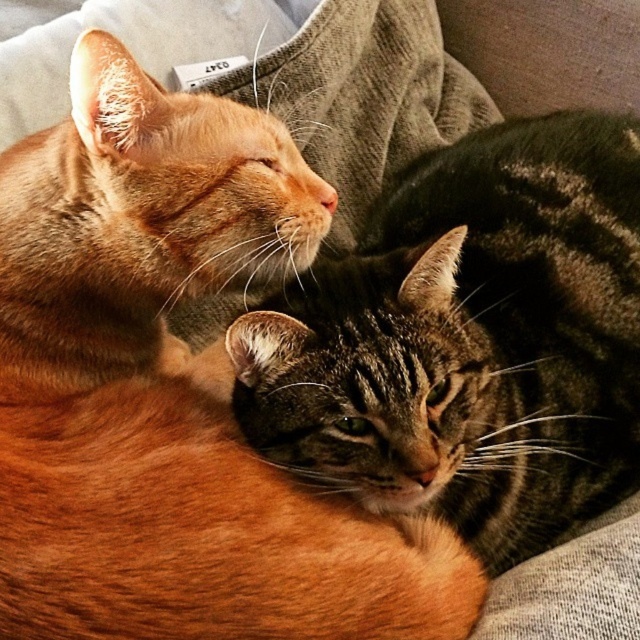
Can you confirm if orange fur cat at upper left is smaller than tabby fur cat at center?

Indeed, orange fur cat at upper left has a smaller size compared to tabby fur cat at center.

Which is behind, point (282, 225) or point (442, 448)?

The point (282, 225) is behind.

Is point (218, 534) farther from camera compared to point (532, 342)?

No.

Image resolution: width=640 pixels, height=640 pixels. In order to click on orange fur cat at upper left in this screenshot , I will do tap(172, 390).